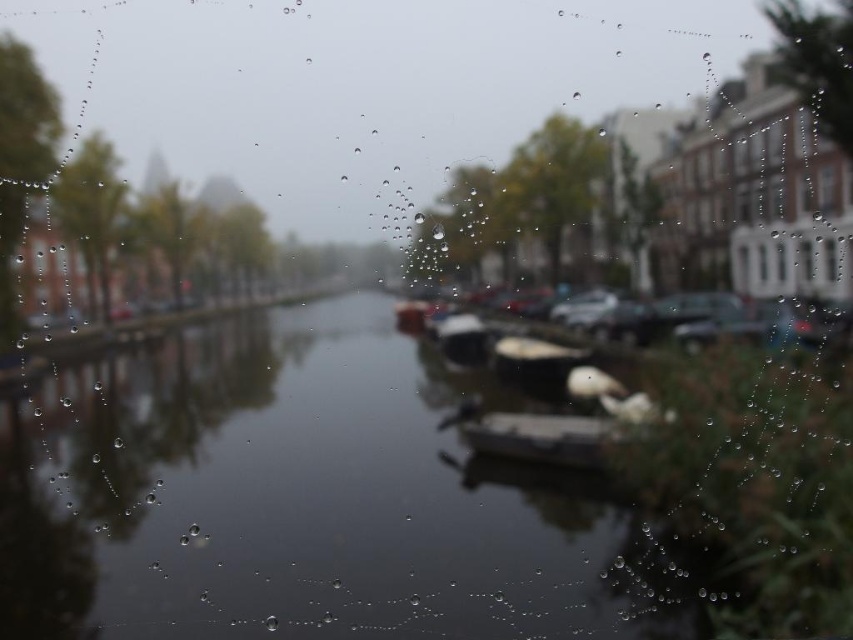
You are standing on the left bank of the canal and want to take a photo of the smooth gray boat at center. Which direction should you face to ensure the boat is in the center of your photo?

You should face towards the center of the canal where the smooth gray boat at center is located, as it is positioned at coordinates approximately 0.684 on the horizontal axis and 0.648 on the vertical axis, making it the central point of the scene.

From the picture: You are a tourist standing on the canal bank and want to take a photo of both the smooth gray boat at center and the smooth white boat at center. Which boat should you focus on first if you want to capture both in one frame without moving your camera?

You should focus on the smooth gray boat at center first because it is larger than the smooth white boat at center, ensuring it fits well in the frame while the smaller boat can still be included without needing to adjust the camera position.